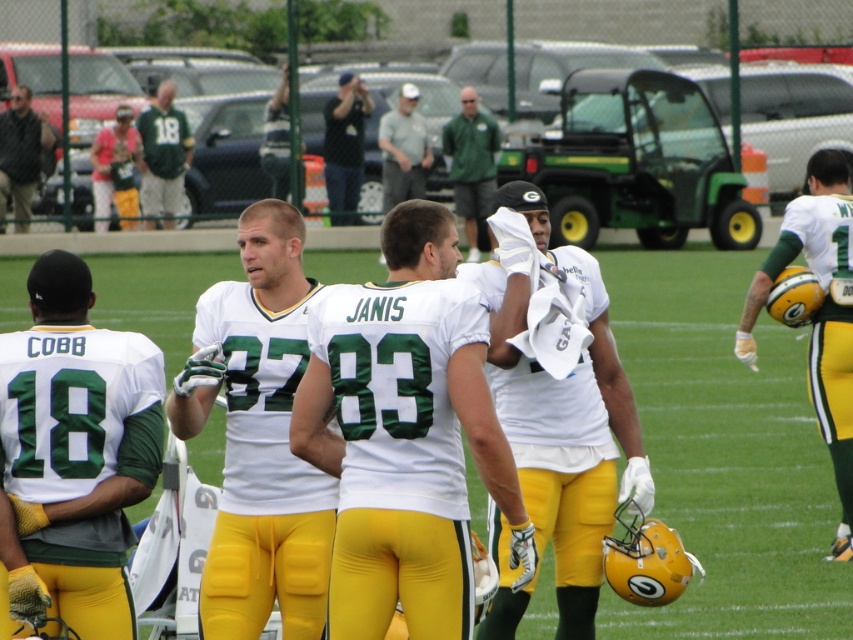
From the picture: You are a photographer positioned at the edge of the field. You need to capture a photo that includes both the green jersey at center and the matte green jersey at upper left. Which jersey should you focus on first to ensure both are in frame?

The green jersey at center is taller than the matte green jersey at upper left, so focusing on the taller one first will help ensure both are in frame.